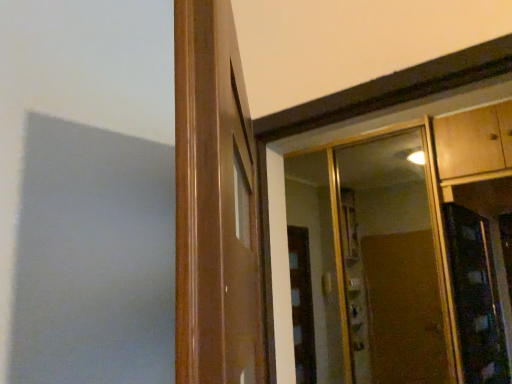
Question: Is clear glass mirror at upper right next to wooden door frame at center?

Choices:
 (A) yes
 (B) no

Answer: (B)

Question: Could you tell me if clear glass mirror at upper right is turned towards wooden door frame at center?

Choices:
 (A) no
 (B) yes

Answer: (B)

Question: From the image's perspective, is clear glass mirror at upper right on wooden door frame at center?

Choices:
 (A) no
 (B) yes

Answer: (A)

Question: Is wooden door frame at center surrounded by clear glass mirror at upper right?

Choices:
 (A) yes
 (B) no

Answer: (B)

Question: Considering the relative sizes of clear glass mirror at upper right and wooden door frame at center in the image provided, is clear glass mirror at upper right wider than wooden door frame at center?

Choices:
 (A) yes
 (B) no

Answer: (B)

Question: Considering their positions, is wooden cabinet at upper right located in front of or behind clear glass mirror at upper right?

Choices:
 (A) front
 (B) behind

Answer: (A)

Question: Based on their sizes in the image, would you say wooden cabinet at upper right is bigger or smaller than clear glass mirror at upper right?

Choices:
 (A) small
 (B) big

Answer: (B)

Question: Is point (473, 147) closer or farther from the camera than point (399, 210)?

Choices:
 (A) closer
 (B) farther

Answer: (A)

Question: Considering the positions of wooden cabinet at upper right and clear glass mirror at upper right in the image, is wooden cabinet at upper right wider or thinner than clear glass mirror at upper right?

Choices:
 (A) wide
 (B) thin

Answer: (A)

Question: Considering the positions of clear glass mirror at upper right and wooden cabinet at upper right in the image, is clear glass mirror at upper right bigger or smaller than wooden cabinet at upper right?

Choices:
 (A) small
 (B) big

Answer: (A)

Question: From a real-world perspective, relative to wooden cabinet at upper right, is clear glass mirror at upper right vertically above or below?

Choices:
 (A) above
 (B) below

Answer: (B)

Question: From their relative heights in the image, would you say clear glass mirror at upper right is taller or shorter than wooden cabinet at upper right?

Choices:
 (A) tall
 (B) short

Answer: (A)

Question: Would you say clear glass mirror at upper right is to the left or to the right of wooden cabinet at upper right in the picture?

Choices:
 (A) left
 (B) right

Answer: (A)

Question: Based on their sizes in the image, would you say wooden door frame at center is bigger or smaller than clear glass mirror at upper right?

Choices:
 (A) small
 (B) big

Answer: (A)

Question: Considering their positions, is wooden door frame at center located in front of or behind clear glass mirror at upper right?

Choices:
 (A) behind
 (B) front

Answer: (B)